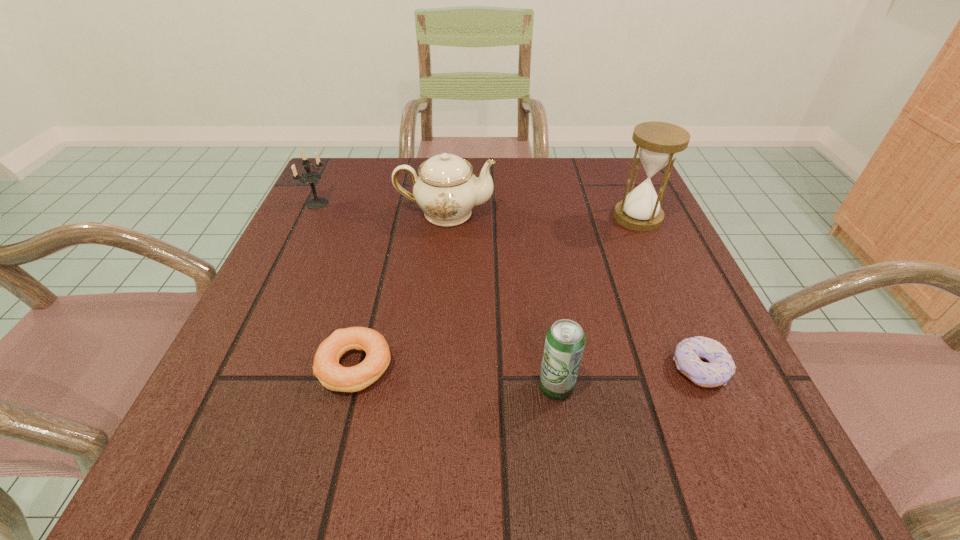
Identify the location of empty location between the tallest object and the fourth object from left to right. The height and width of the screenshot is (540, 960). (597, 302).

This screenshot has width=960, height=540. Identify the location of vacant point located between the third object from right to left and the bagel. (456, 376).

You are a GUI agent. You are given a task and a screenshot of the screen. Output one action in this format:
    pyautogui.click(x=<x>, y=<y>)
    Task: Click on the blank region between the chinaware and the candle holder
    This screenshot has height=540, width=960.
    Given the screenshot: What is the action you would take?
    pyautogui.click(x=381, y=208)

Where is `unoccupied position between the doughnut and the hourglass`? unoccupied position between the doughnut and the hourglass is located at coordinates (668, 293).

The image size is (960, 540). In order to click on unoccupied position between the hourglass and the leftmost object in this screenshot , I will do `click(478, 210)`.

This screenshot has width=960, height=540. In order to click on vacant area that lies between the chinaware and the bagel in this screenshot , I will do `click(400, 289)`.

The image size is (960, 540). Identify the location of free point between the hourglass and the bagel. (496, 292).

Select which object appears as the third closest to the beer can. Please provide its 2D coordinates. Your answer should be formatted as a tuple, i.e. [(x, y)], where the tuple contains the x and y coordinates of a point satisfying the conditions above.

[(446, 189)]

Where is `object that is the fourth closest to the beer can`? The width and height of the screenshot is (960, 540). object that is the fourth closest to the beer can is located at coordinates (657, 143).

Find the location of `vacant position in the image that satisfies the following two spatial constraints: 1. at the spout of the chinaware; 2. on the right side of the doughnut`. vacant position in the image that satisfies the following two spatial constraints: 1. at the spout of the chinaware; 2. on the right side of the doughnut is located at coordinates (x=430, y=369).